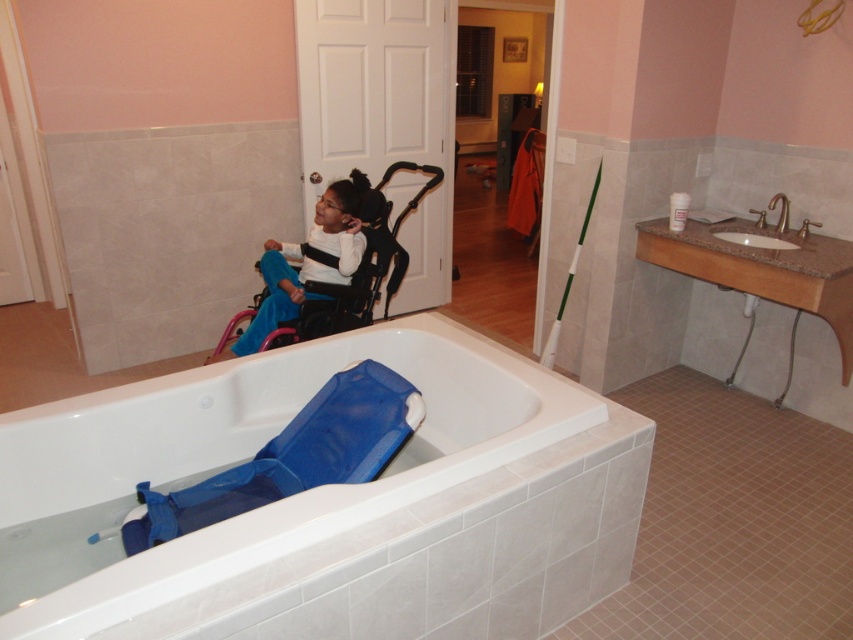
You are a caregiver in a bathroom. You need to move a toy from the blue mesh baby carriage at lower left to the white marble sink at upper right. Which direction should you move the toy?

The blue mesh baby carriage at lower left is to the left of the white marble sink at upper right, so you should move the toy to the right direction.

You are standing in the bathroom and want to reach both points. Which point, point (299,275) or point (751,237), will you reach first as you move towards them?

You will reach point (299,275) first because it is closer to you than point (751,237), which is further away.

You are a caregiver assisting a child in a bathroom. You need to determine if the wheelchair can fit through the space between the white plastic bathtub at lower left and the matte black wheelchair at upper left. Can it pass through?

The white plastic bathtub at lower left is shorter than the matte black wheelchair at upper left. Since the wheelchair is taller, it cannot pass through the space between them without hitting the bathtub.